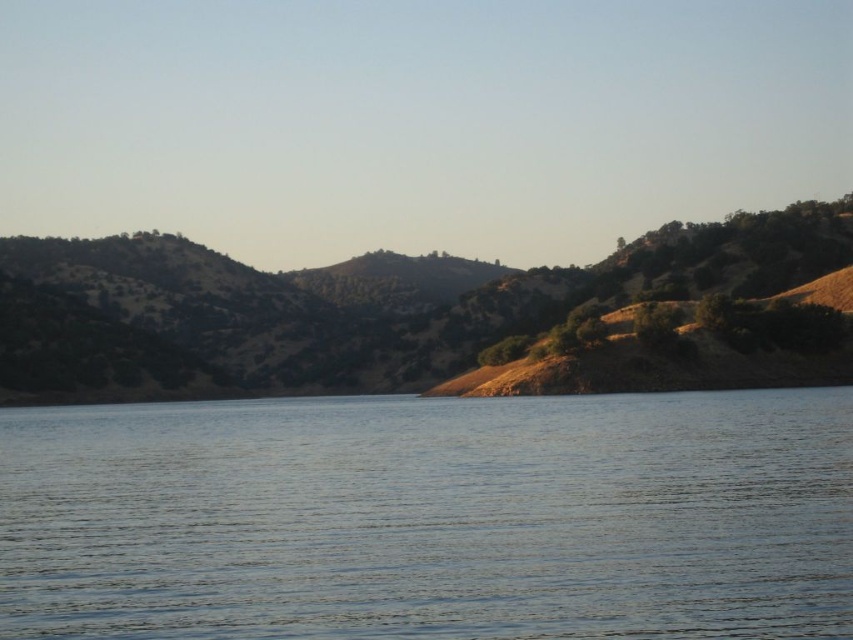
Between clear water at center and brown/dry soil at left, which one is positioned lower?

clear water at center

Is point (463, 605) more distant than point (457, 353)?

No, (463, 605) is closer to viewer.

Is point (27, 490) less distant than point (252, 349)?

Yes, point (27, 490) is in front of point (252, 349).

Locate an element on the screen. clear water at center is located at coordinates (430, 516).